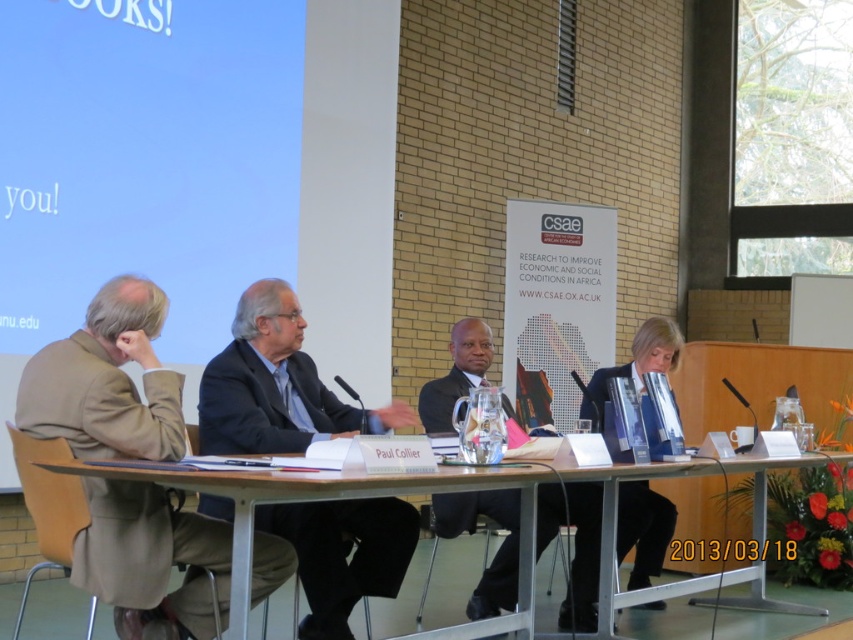
You are organizing a panel discussion and need to arrange nameplates for the participants. The nameplate for the person in the brown woolen jacket at left must be wider than the one for the blue fabric jacket at center. Based on the image, is this requirement already met?

The brown woolen jacket at left has a larger width than the blue fabric jacket at center, so the requirement is already met.